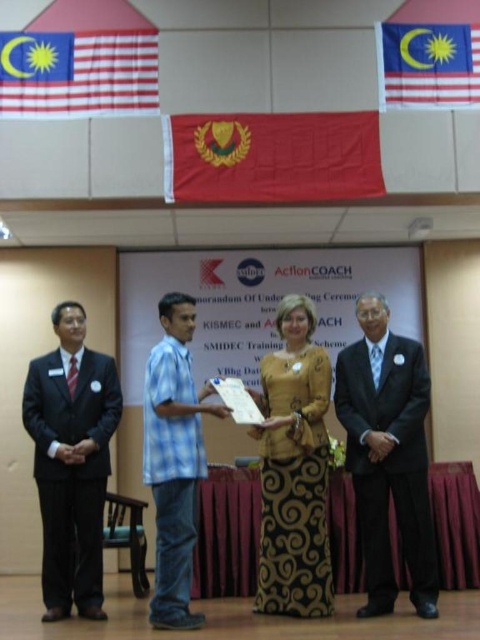
Question: Does yellow printed skirt at center come in front of red fabric flag at center?

Choices:
 (A) no
 (B) yes

Answer: (B)

Question: Estimate the real-world distances between objects in this image. Which object is farther from the red fabric flag at upper left?

Choices:
 (A) red fabric flag at upper right
 (B) black suit at left
 (C) matte black suit at right

Answer: (C)

Question: Which of the following is the farthest from the observer?

Choices:
 (A) (396, 422)
 (B) (24, 90)

Answer: (B)

Question: Among these points, which one is farthest from the camera?

Choices:
 (A) (170, 628)
 (B) (371, 314)
 (C) (144, 44)
 (D) (68, 460)

Answer: (C)

Question: Is matte black suit at right above red fabric flag at center?

Choices:
 (A) yes
 (B) no

Answer: (B)

Question: Can you confirm if matte black suit at right is positioned to the left of red fabric flag at center?

Choices:
 (A) yes
 (B) no

Answer: (B)